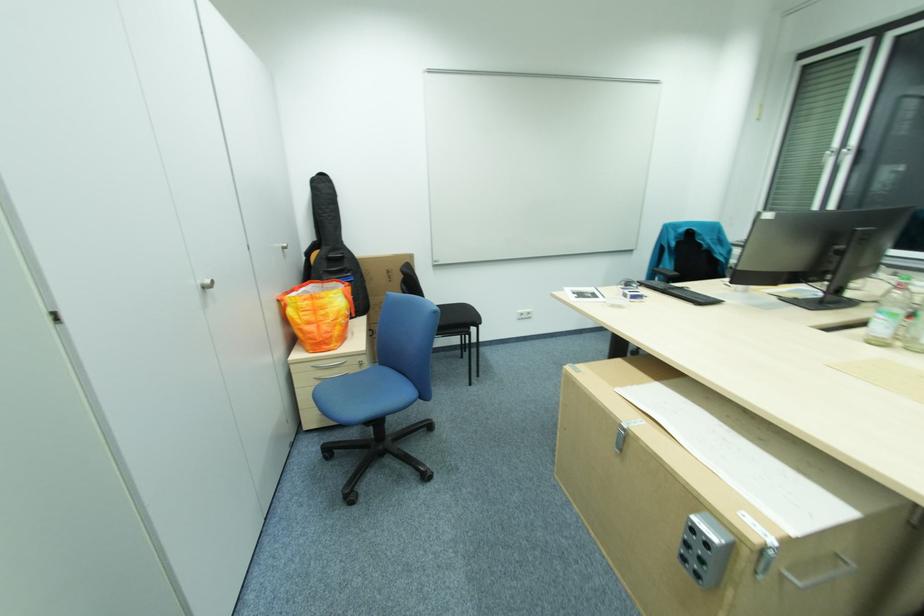
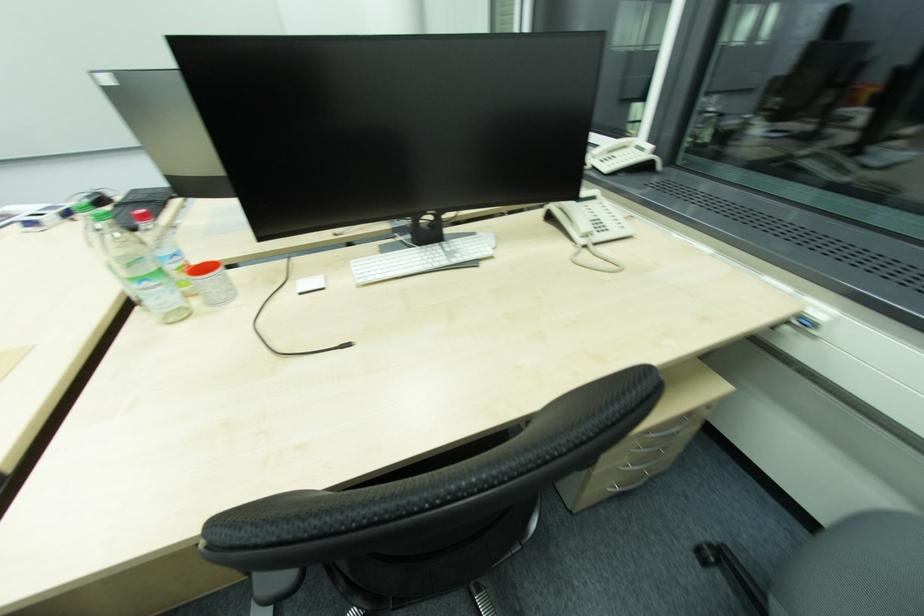
Question: What movement of the cameraman would produce the second image?

Choices:
 (A) Left
 (B) Right
 (C) Forward
 (D) Backward

Answer: (B)